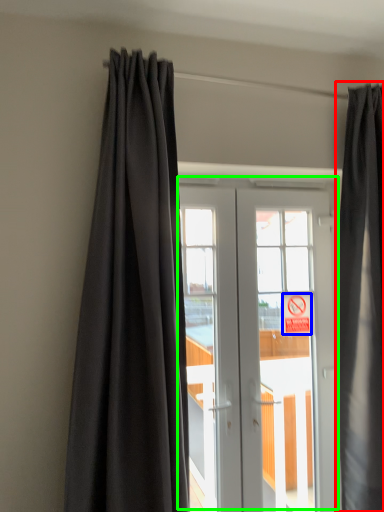
Question: Estimate the real-world distances between objects in this image. Which object is closer to curtain (highlighted by a red box), parking sign (highlighted by a blue box) or door (highlighted by a green box)?

Choices:
 (A) parking sign
 (B) door

Answer: (B)